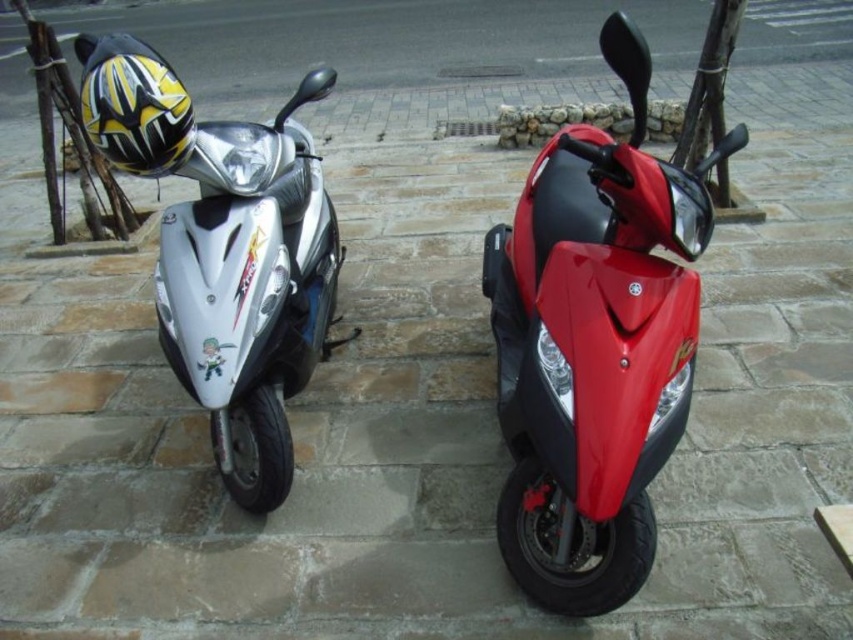
You are standing at the point marked by the coordinates point (596, 339) in the image. Looking around, you see two scooters parked side by side. Which scooter is the one you are currently standing at?

The point (596, 339) indicates shiny red scooter at center, so you are standing at the shiny red scooter at center.

You are a delivery person who needs to park your scooter between the shiny silver scooter at left and the shiny red scooter at center. Is there enough space for your scooter which is 1.2 meters wide?

The shiny red scooter at center is to the right of the shiny silver scooter at left. Since the distance between them isn